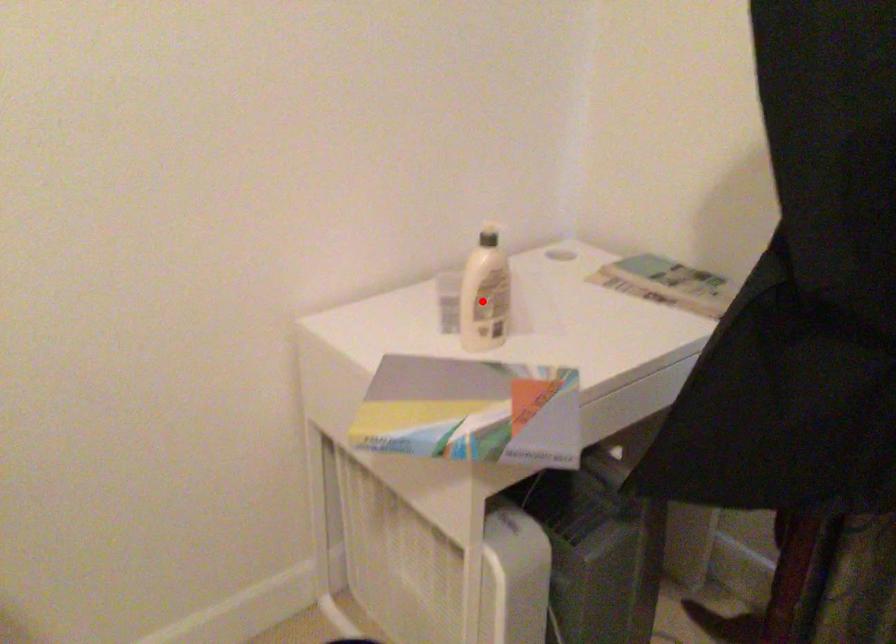
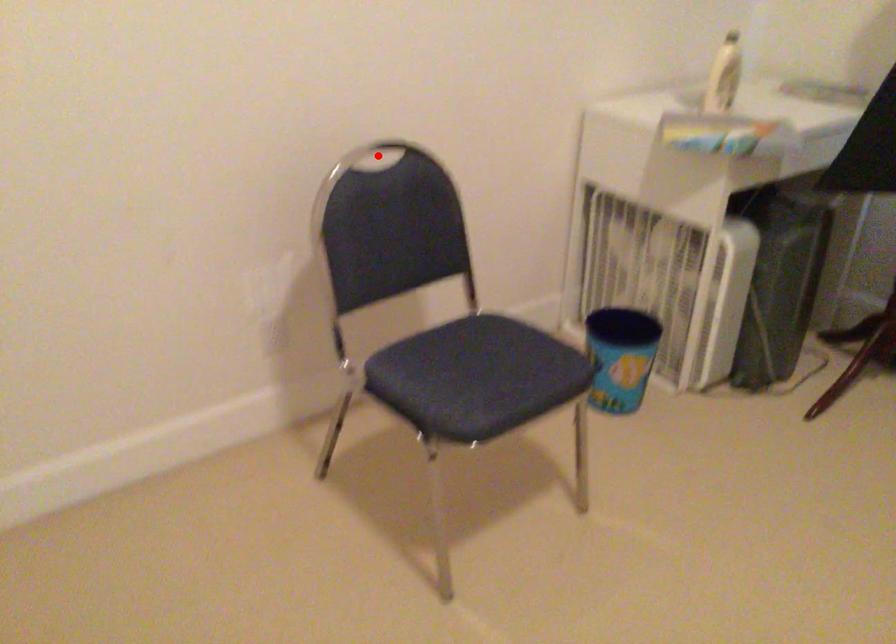
I am providing you with two images of the same scene from different viewpoints. A red point is marked on the first image and another point is marked on the second image. Do the highlighted points in image1 and image2 indicate the same real-world spot?

No